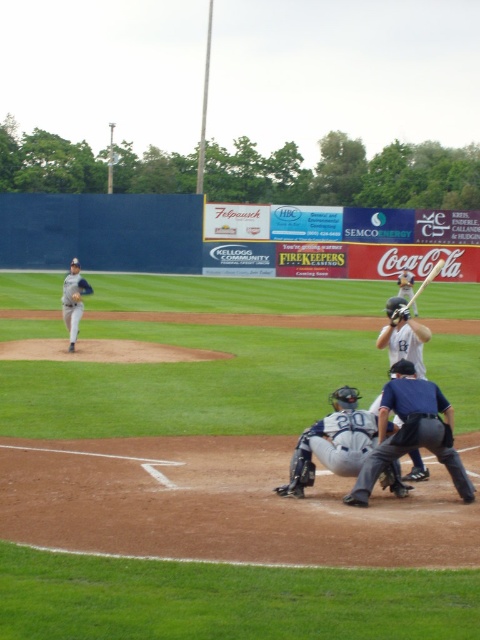
Is blue uniform at lower center bigger than matte gray helmet at upper center?

Actually, blue uniform at lower center might be smaller than matte gray helmet at upper center.

Between blue uniform at lower center and matte gray helmet at upper center, which one has less height?

Standing shorter between the two is blue uniform at lower center.

Identify the location of blue uniform at lower center. (411, 433).

Can you confirm if white matte baseball bat at center is positioned below matte gray helmet at upper center?

Correct, white matte baseball bat at center is located below matte gray helmet at upper center.

Does white matte baseball bat at center appear over matte gray helmet at upper center?

Incorrect, white matte baseball bat at center is not positioned above matte gray helmet at upper center.

Is point (404, 320) closer to viewer compared to point (399, 282)?

Yes.

The image size is (480, 640). I want to click on white matte baseball bat at center, so click(x=403, y=336).

Based on the photo, between gray matte uniform at center and matte gray helmet at upper center, which one appears on the right side from the viewer's perspective?

From the viewer's perspective, matte gray helmet at upper center appears more on the right side.

Is gray matte uniform at center to the right of matte gray helmet at upper center from the viewer's perspective?

No, gray matte uniform at center is not to the right of matte gray helmet at upper center.

Which is in front, point (311, 476) or point (397, 278)?

Point (311, 476)

The image size is (480, 640). I want to click on gray matte uniform at center, so click(x=333, y=442).